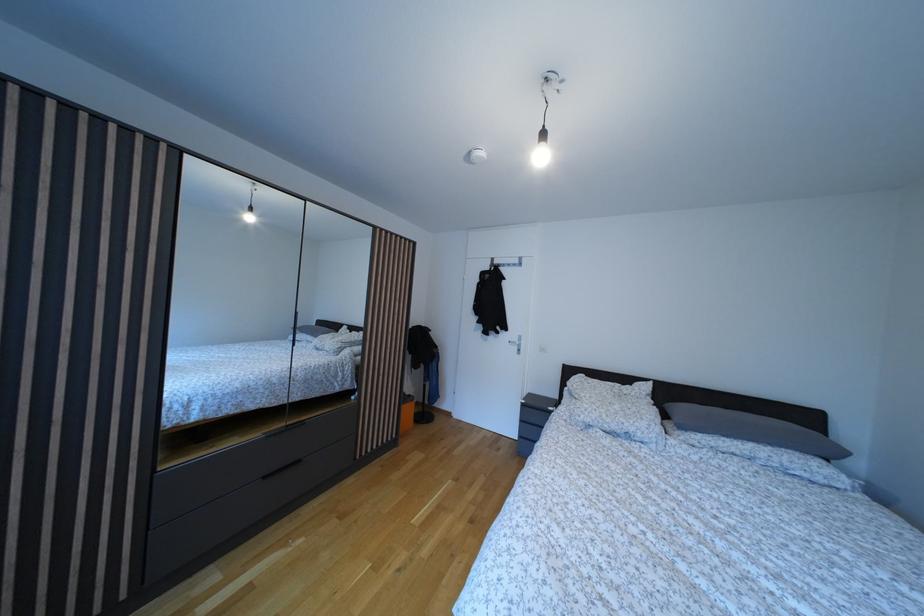
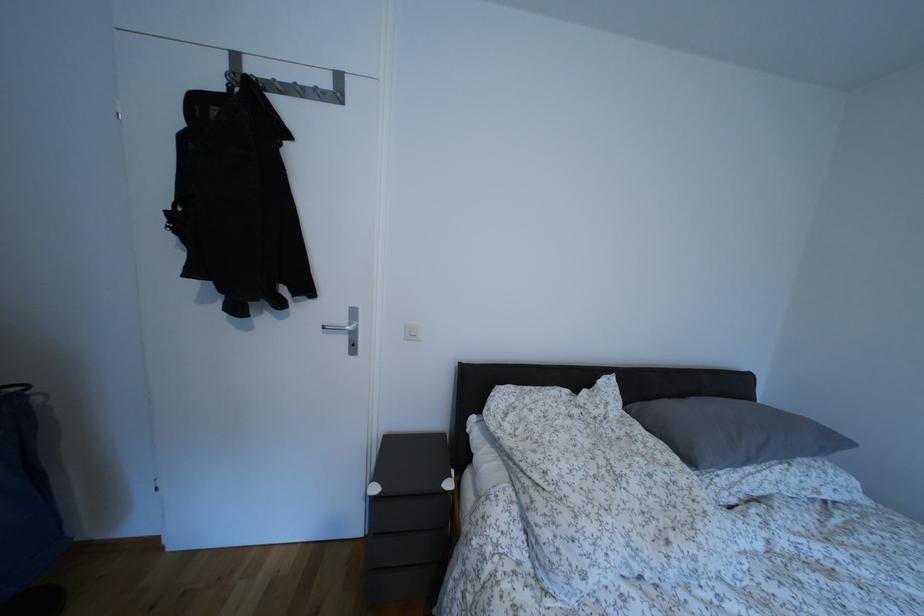
Locate, in the second image, the point that corresponds to the point at 523,346 in the first image.

(348, 325)